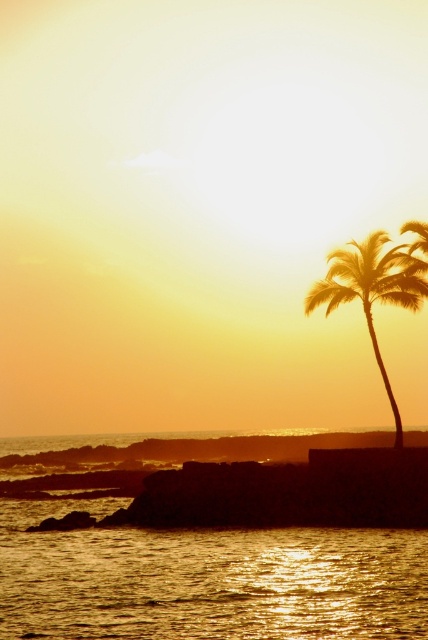
You are standing at the point closer to the camera in the image. Which point are you at, point (407, 592) or point (410, 284)?

You are at point (407, 592) because it is closer to the camera than point (410, 284).

You are standing on the beach looking at the golden reflective water at center and the silhouette palm tree at right. Which object is positioned lower in the image?

The golden reflective water at center is positioned lower than the silhouette palm tree at right in the image.

You are a photographer standing at the base of the silhouette palm tree at right. You want to capture a photo of the golden reflective water at center without the palm tree appearing in the frame. Is there enough space between you and the water to step back and frame the shot properly?

The golden reflective water at center is 11.87 meters away from the silhouette palm tree at right. Since you are standing at the base of the silhouette palm tree at right, you have sufficient space to step back and frame the shot without the palm tree appearing in the frame.